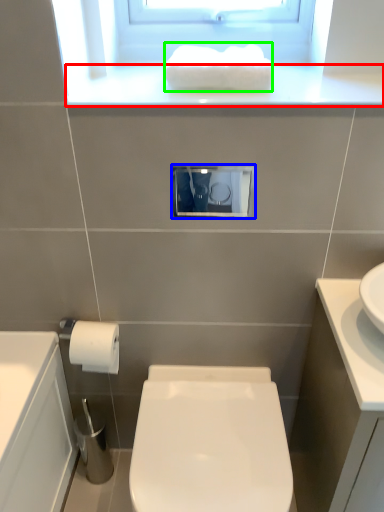
Question: Based on their relative distances, which object is nearer to window sill (highlighted by a red box)? Choose from medicine cabinet (highlighted by a blue box) and hand towel (highlighted by a green box).

Choices:
 (A) medicine cabinet
 (B) hand towel

Answer: (B)